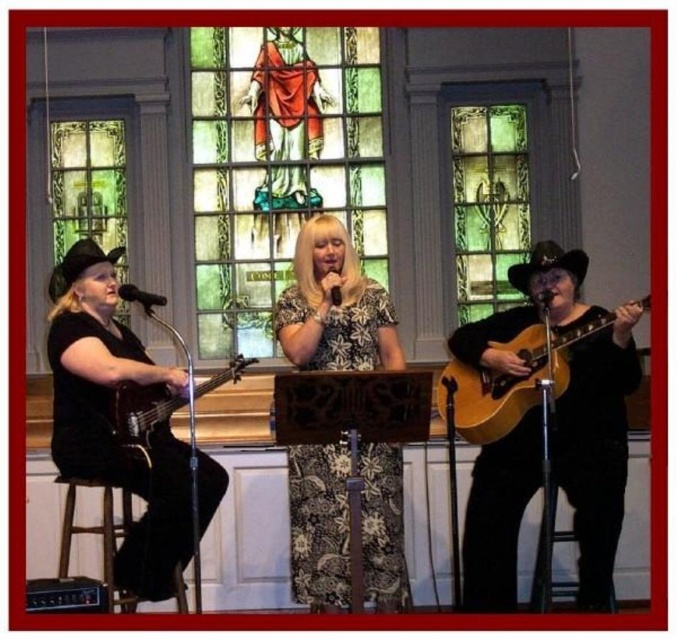
Question: Is matte brown guitar at right wider than black matte guitar at left?

Choices:
 (A) no
 (B) yes

Answer: (A)

Question: Is green stained glass at upper center closer to camera compared to brown wooden bar stool at lower left?

Choices:
 (A) no
 (B) yes

Answer: (A)

Question: Among these objects, which one is nearest to the camera?

Choices:
 (A) green stained glass at upper center
 (B) floral fabric dress at center

Answer: (B)

Question: Which is nearer to the matte brown guitar at right?

Choices:
 (A) matte black guitar at left
 (B) floral fabric dress at center

Answer: (B)

Question: Is stained glass at center thinner than green stained glass at left?

Choices:
 (A) yes
 (B) no

Answer: (B)

Question: Estimate the real-world distances between objects in this image. Which object is closer to the green stained glass at upper center?

Choices:
 (A) brown wooden bar stool at lower left
 (B) matte brown guitar at right

Answer: (B)